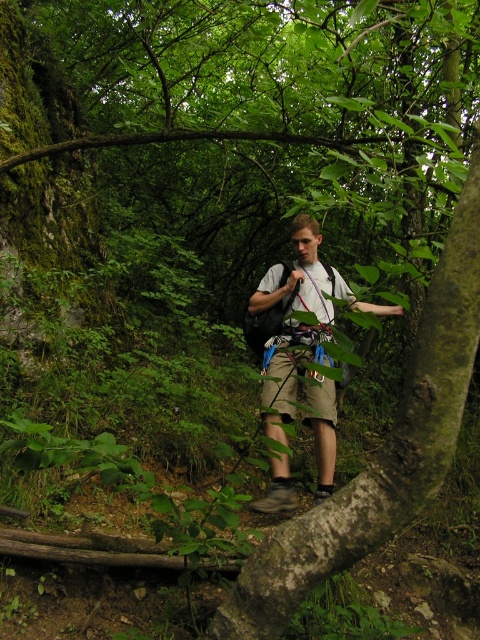
Question: Which of the following is the closest to the observer?

Choices:
 (A) (335, 445)
 (B) (297, 564)

Answer: (B)

Question: Can you confirm if green rough bark tree trunk at center is positioned to the right of light gray fabric backpack at center?

Choices:
 (A) no
 (B) yes

Answer: (B)

Question: Which point appears farthest from the camera in this image?

Choices:
 (A) (304, 404)
 (B) (286, 602)

Answer: (A)

Question: Does green rough bark tree trunk at center have a lesser width compared to light gray fabric backpack at center?

Choices:
 (A) no
 (B) yes

Answer: (B)

Question: Is green rough bark tree trunk at center positioned behind light gray fabric backpack at center?

Choices:
 (A) yes
 (B) no

Answer: (B)

Question: Which point appears closest to the camera in this image?

Choices:
 (A) (280, 477)
 (B) (476, 129)

Answer: (B)